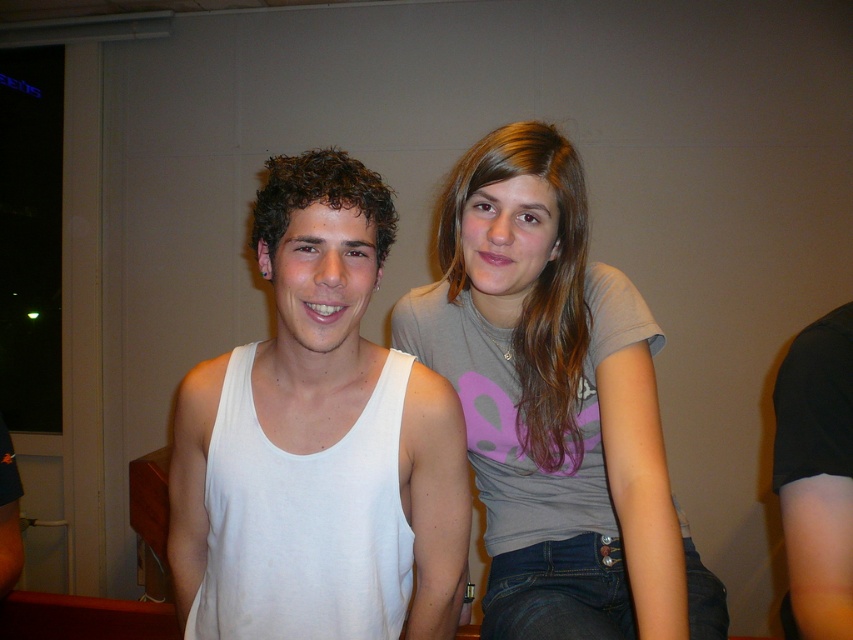
You are standing in front of the image and want to know how far the point at coordinates point (426, 545) is from you. Can you determine the distance?

The point (426, 545) is 3.38 feet away from the viewer.